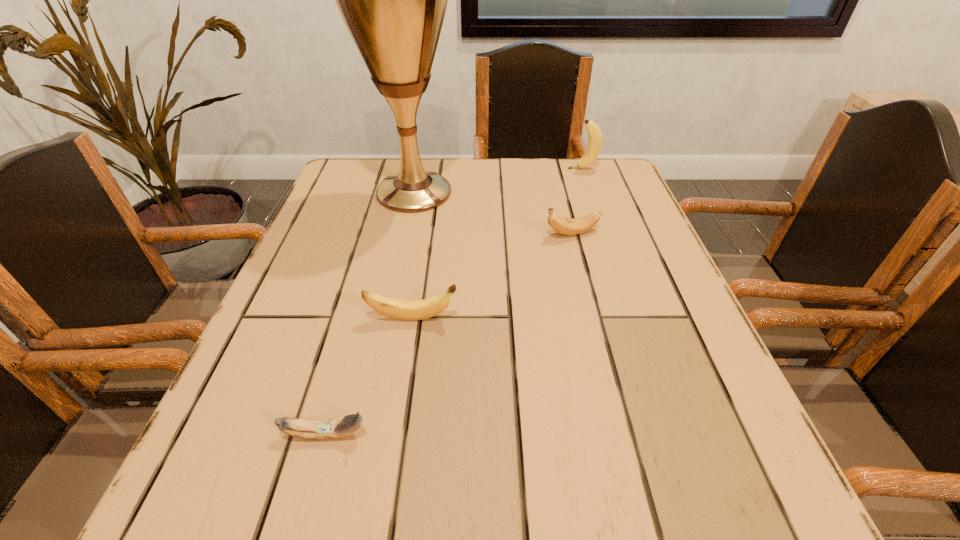
In order to click on trophy cup in this screenshot , I will do `click(393, 0)`.

Identify the location of the farthest banana. (594, 145).

Where is `the second tallest object`? the second tallest object is located at coordinates (594, 145).

Where is `the second nearest banana`? This screenshot has width=960, height=540. the second nearest banana is located at coordinates (400, 309).

Image resolution: width=960 pixels, height=540 pixels. I want to click on the second farthest banana, so (566, 226).

This screenshot has height=540, width=960. Find the location of `the nearest object`. the nearest object is located at coordinates (336, 427).

I want to click on vacant space located 0.120m on the right of the trophy cup, so click(x=510, y=192).

The height and width of the screenshot is (540, 960). I want to click on blank space located from the stem of the farthest banana, so click(x=545, y=168).

This screenshot has width=960, height=540. I want to click on free space located from the stem of the farthest banana, so click(435, 168).

Where is `vacant space situated from the stem of the farthest banana`? Image resolution: width=960 pixels, height=540 pixels. vacant space situated from the stem of the farthest banana is located at coordinates (515, 168).